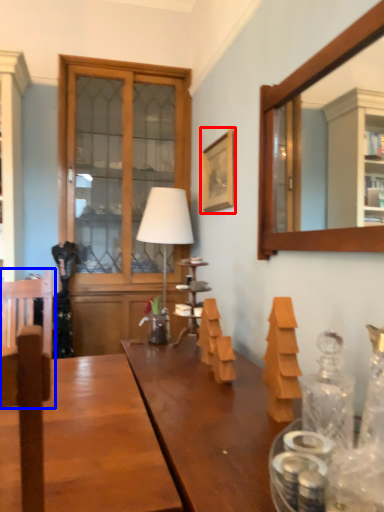
Question: Which point is further to the camera, picture frame (highlighted by a red box) or swivel chair (highlighted by a blue box)?

Choices:
 (A) picture frame
 (B) swivel chair

Answer: (A)